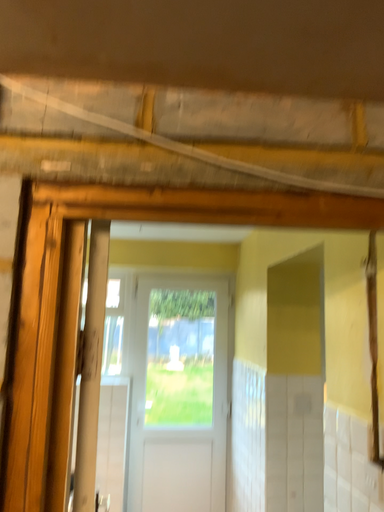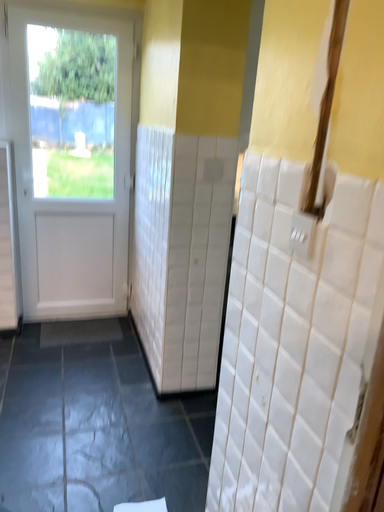
Question: Which way did the camera rotate in the video?

Choices:
 (A) rotated left
 (B) rotated right

Answer: (B)